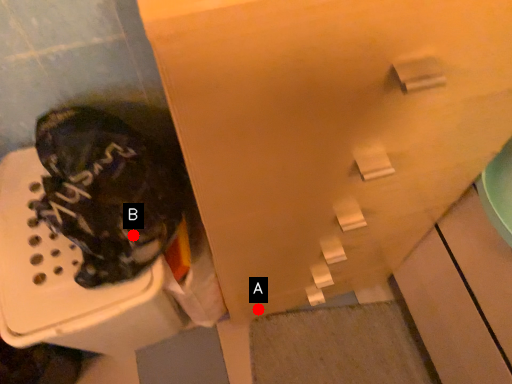
Question: Two points are circled on the image, labeled by A and B beside each circle. Among these points, which one is farthest from the camera?

Choices:
 (A) A is further
 (B) B is further

Answer: (A)